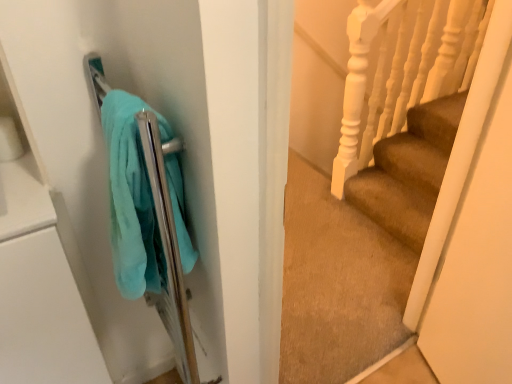
The height and width of the screenshot is (384, 512). Describe the element at coordinates (132, 198) in the screenshot. I see `teal plush towel at left` at that location.

Where is `teal plush towel at left`? The image size is (512, 384). teal plush towel at left is located at coordinates (132, 198).

Find the location of `teal plush towel at left`. teal plush towel at left is located at coordinates (132, 198).